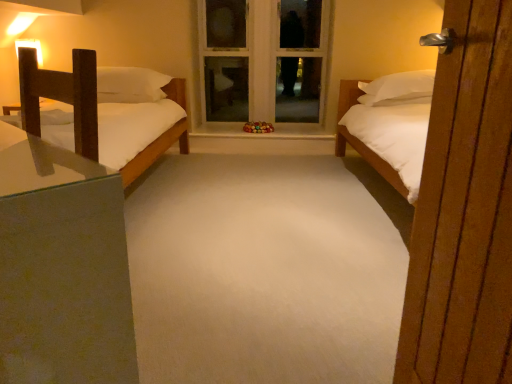
What is the approximate width of white painted wood window frame at center?

It is 7.65 inches.

What are the coordinates of `white painted wood window frame at center` in the screenshot? It's located at (263, 59).

This screenshot has width=512, height=384. I want to click on wooden door at right, so click(x=464, y=211).

You are a GUI agent. You are given a task and a screenshot of the screen. Output one action in this format:
    pyautogui.click(x=<x>, y=<y>)
    Task: Click on the white soft carpet at center
    
    Given the screenshot: What is the action you would take?
    pyautogui.click(x=266, y=270)

Which of these two, white soft carpet at center or white painted wood window frame at center, stands shorter?

white soft carpet at center is shorter.

Considering the positions of points (372, 303) and (291, 83), is point (372, 303) closer to camera compared to point (291, 83)?

Yes, point (372, 303) is in front of point (291, 83).

Locate an element on the screen. The width and height of the screenshot is (512, 384). plain to the left of white painted wood window frame at center is located at coordinates (266, 270).

Is white soft carpet at center touching white painted wood window frame at center?

No, white soft carpet at center is not touching white painted wood window frame at center.

From the image's perspective, which is above, white soft carpet at center or wooden door at right?

white soft carpet at center, from the image's perspective.

Could you tell me if white soft carpet at center is turned towards wooden door at right?

No.

Based on the photo, considering the relative sizes of wooden door at right and white painted wood window frame at center in the image provided, is wooden door at right wider than white painted wood window frame at center?

No.

Which is closer to the camera, [449,185] or [304,93]?

Point [449,185] is closer to the camera than point [304,93].

From the image's perspective, is wooden door at right above or below white painted wood window frame at center?

wooden door at right is situated lower than white painted wood window frame at center in the image.

Consider the image. Which object is positioned more to the left, wooden door at right or white soft carpet at center?

white soft carpet at center.

From the image's perspective, is wooden door at right below white soft carpet at center?

Yes.

Considering the sizes of wooden door at right and white soft carpet at center in the image, is wooden door at right wider or thinner than white soft carpet at center?

Considering their sizes, wooden door at right looks slimmer than white soft carpet at center.

Considering the relative sizes of wooden door at right and white soft carpet at center in the image provided, is wooden door at right bigger than white soft carpet at center?

Actually, wooden door at right might be smaller than white soft carpet at center.

From a real-world perspective, is white painted wood window frame at center positioned above or below wooden door at right?

In terms of real-world spatial position, white painted wood window frame at center is above wooden door at right.

Which is behind, point (199, 11) or point (451, 173)?

The point (199, 11) is farther from the camera.

Is wooden door at right at the back of white painted wood window frame at center?

That's not correct — white painted wood window frame at center is not looking away from wooden door at right.

Considering the relative sizes of wooden door at right and wooden nightstand at left in the image provided, is wooden door at right wider than wooden nightstand at left?

Incorrect, the width of wooden door at right does not surpass that of wooden nightstand at left.

Considering the points (448, 203) and (35, 319), which point is behind, point (448, 203) or point (35, 319)?

Positioned behind is point (448, 203).

Which object is positioned more to the left, wooden door at right or wooden nightstand at left?

wooden nightstand at left is more to the left.

From the image's perspective, which is below, wooden door at right or wooden nightstand at left?

From the image's view, wooden door at right is below.

Can you confirm if wooden nightstand at left is bigger than white painted wood window frame at center?

Incorrect, wooden nightstand at left is not larger than white painted wood window frame at center.

From a real-world perspective, is wooden nightstand at left below white painted wood window frame at center?

Indeed, from a real-world perspective, wooden nightstand at left is positioned beneath white painted wood window frame at center.

Is wooden nightstand at left wider or thinner than white painted wood window frame at center?

Considering their sizes, wooden nightstand at left looks broader than white painted wood window frame at center.

Is wooden nightstand at left oriented towards white painted wood window frame at center?

No, wooden nightstand at left is not aimed at white painted wood window frame at center.

Identify the location of window frame lying behind the white soft carpet at center. This screenshot has height=384, width=512. (263, 59).

Image resolution: width=512 pixels, height=384 pixels. I want to click on plain on the left of wooden door at right, so click(266, 270).

Based on their spatial positions, is wooden nightstand at left or white painted wood window frame at center closer to white soft carpet at center?

wooden nightstand at left lies closer to white soft carpet at center than the other object.

From the image, which object appears to be nearer to wooden door at right, white soft carpet at center or wooden nightstand at left?

wooden nightstand at left is closer to wooden door at right.

Consider the image. From the image, which object appears to be farther from wooden nightstand at left, white painted wood window frame at center or white soft carpet at center?

Among the two, white painted wood window frame at center is located further to wooden nightstand at left.

From the image, which object appears to be nearer to wooden nightstand at left, white painted wood window frame at center or wooden door at right?

wooden door at right is positioned closer to the anchor wooden nightstand at left.

Considering their positions, is white painted wood window frame at center positioned closer to wooden door at right than white soft carpet at center?

white soft carpet at center is positioned closer to the anchor wooden door at right.

Looking at the image, which one is located further to white painted wood window frame at center, wooden nightstand at left or white soft carpet at center?

wooden nightstand at left lies further to white painted wood window frame at center than the other object.

Which object lies further to the anchor point wooden nightstand at left, wooden door at right or white soft carpet at center?

white soft carpet at center is positioned further to the anchor wooden nightstand at left.

Considering their positions, is wooden door at right positioned further to white soft carpet at center than white painted wood window frame at center?

Based on the image, white painted wood window frame at center appears to be further to white soft carpet at center.

The width and height of the screenshot is (512, 384). What are the coordinates of `plain between wooden nightstand at left and wooden door at right in the horizontal direction` in the screenshot? It's located at (266, 270).

Where is `nightstand between wooden door at right and white painted wood window frame at center in the front-back direction`? nightstand between wooden door at right and white painted wood window frame at center in the front-back direction is located at coordinates (62, 268).

You are a GUI agent. You are given a task and a screenshot of the screen. Output one action in this format:
    pyautogui.click(x=<x>, y=<y>)
    Task: Click on the plain between wooden door at right and white painted wood window frame at center in the front-back direction
    Image resolution: width=512 pixels, height=384 pixels.
    Given the screenshot: What is the action you would take?
    pyautogui.click(x=266, y=270)

Locate an element on the screen. plain between wooden nightstand at left and white painted wood window frame at center in the front-back direction is located at coordinates (266, 270).